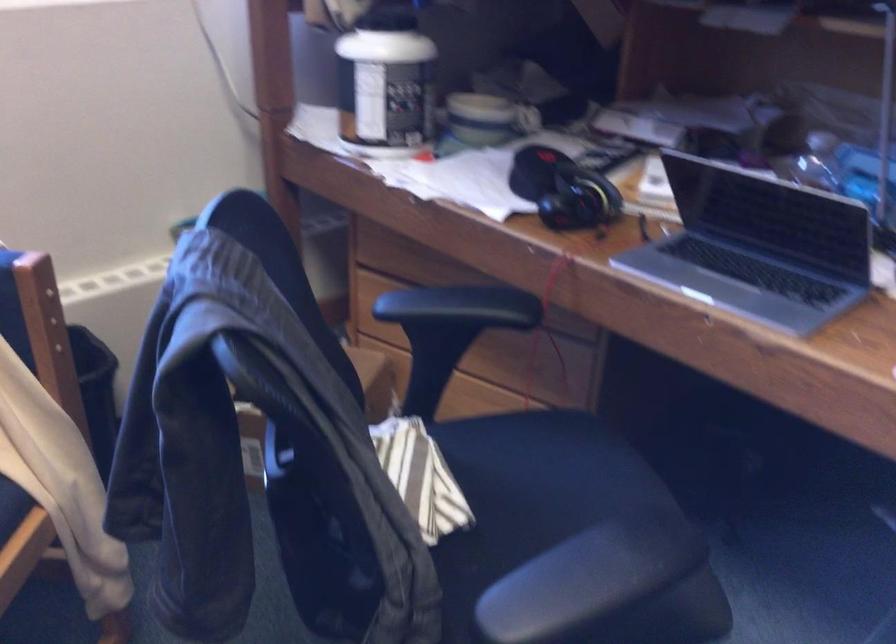
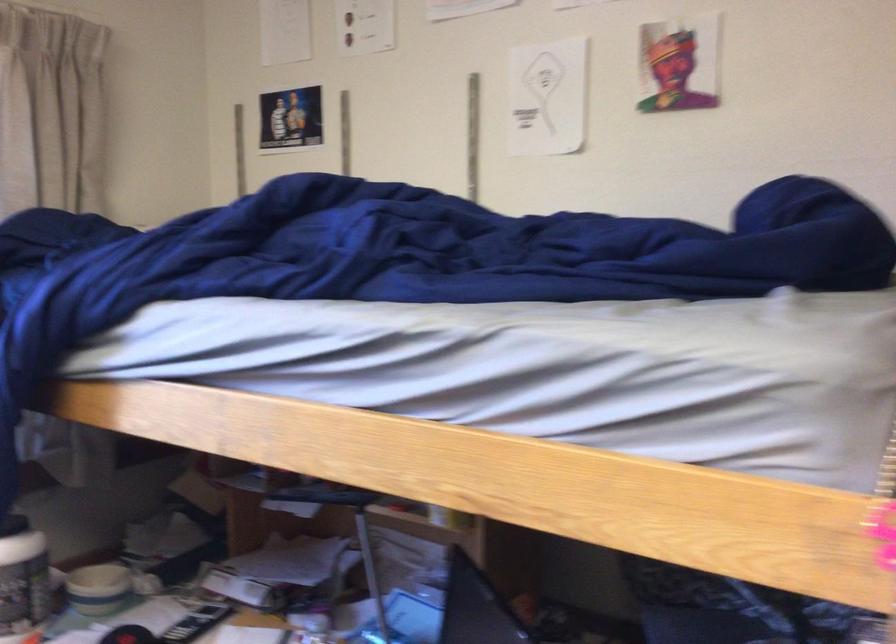
Find the pixel in the second image that matches point (412, 80) in the first image.

(22, 581)